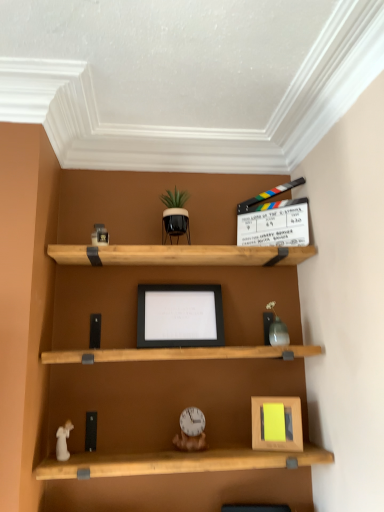
Question: Do you think matte gray vase at upper right, the second toy from the top, is within wooden picture frame at lower right, placed as the 2th picture frame when sorted from left to right, or outside of it?

Choices:
 (A) inside
 (B) outside

Answer: (B)

Question: Is matte gray vase at upper right, acting as the fourth toy starting from the left, in front of or behind wooden picture frame at lower right, positioned as the first picture frame in bottom-to-top order, in the image?

Choices:
 (A) behind
 (B) front

Answer: (A)

Question: Considering the real-world distances, which object is farthest from the white porcelain angel at lower left, positioned as the 4th toy in right-to-left order?

Choices:
 (A) metallic gold toy at upper left, the first toy in the top-to-bottom sequence
 (B) wooden clock at center, arranged as the fourth toy when viewed from the top
 (C) wooden picture frame at lower right, positioned as the first picture frame in bottom-to-top order
 (D) matte gray vase at upper right, the first toy viewed from the right
 (E) black matte picture frame at center, the 2th picture frame viewed from the front

Answer: (D)

Question: Estimate the real-world distances between objects in this image. Which object is closer to the wooden picture frame at lower right, which appears as the 1th picture frame when viewed from the right?

Choices:
 (A) white porcelain angel at lower left, marked as the 2th toy in a bottom-to-top arrangement
 (B) wooden clock at center, arranged as the fourth toy when viewed from the top
 (C) metallic gold toy at upper left, which appears as the fourth toy when ordered from the bottom
 (D) black matte picture frame at center, which is the 1th picture frame in top-to-bottom order
 (E) matte gray vase at upper right, acting as the fourth toy starting from the left

Answer: (B)